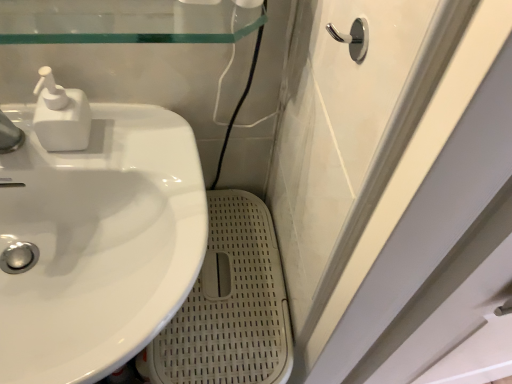
What is the approximate width of polished chrome hook at upper right?

The width of polished chrome hook at upper right is 3.68 centimeters.

Find the location of `polished chrome hook at upper right`. polished chrome hook at upper right is located at coordinates (353, 38).

The width and height of the screenshot is (512, 384). In order to click on white matte soap dispenser at upper left in this screenshot , I will do `click(60, 115)`.

Identify the location of polished chrome hook at upper right. (353, 38).

Do you think white matte soap dispenser at upper left is within white glossy sink at left, or outside of it?

white matte soap dispenser at upper left is outside white glossy sink at left.

From a real-world perspective, which object stands above the other?

From a 3D spatial view, white matte soap dispenser at upper left is above.

Does white matte soap dispenser at upper left appear on the right side of white glossy sink at left?

In fact, white matte soap dispenser at upper left is to the left of white glossy sink at left.

Is white matte soap dispenser at upper left in contact with white glossy sink at left?

No, white matte soap dispenser at upper left is not touching white glossy sink at left.

Can you tell me how much polished chrome hook at upper right and white matte soap dispenser at upper left differ in facing direction?

The facing directions of polished chrome hook at upper right and white matte soap dispenser at upper left are 89.3 degrees apart.

Is polished chrome hook at upper right beside white matte soap dispenser at upper left?

No.

Identify the location of door handle in front of the white matte soap dispenser at upper left. (353, 38).

Could you tell me if polished chrome hook at upper right is turned towards white matte soap dispenser at upper left?

No.

Is point (188, 149) behind point (348, 41)?

Yes, point (188, 149) is farther from viewer.

How different are the orientations of white glossy sink at left and polished chrome hook at upper right in degrees?

The angle between the facing direction of white glossy sink at left and the facing direction of polished chrome hook at upper right is 89.3 degrees.

How far apart are white glossy sink at left and polished chrome hook at upper right?

white glossy sink at left and polished chrome hook at upper right are 18.20 inches apart.

Does white glossy sink at left have a larger size compared to polished chrome hook at upper right?

Yes.

Is white matte soap dispenser at upper left completely or partially outside of polished chrome hook at upper right?

Yes.

From the image's perspective, which one is positioned lower, white matte soap dispenser at upper left or polished chrome hook at upper right?

white matte soap dispenser at upper left appears lower in the image.

Which of these two, white matte soap dispenser at upper left or polished chrome hook at upper right, stands shorter?

With less height is polished chrome hook at upper right.

Which is behind, white matte soap dispenser at upper left or polished chrome hook at upper right?

Positioned behind is white matte soap dispenser at upper left.

Considering the relative sizes of polished chrome hook at upper right and white glossy sink at left in the image provided, is polished chrome hook at upper right thinner than white glossy sink at left?

Yes, polished chrome hook at upper right is thinner than white glossy sink at left.

Would you say polished chrome hook at upper right is to the left or to the right of white glossy sink at left in the picture?

polished chrome hook at upper right is positioned on white glossy sink at left's right side.

Considering the relative positions of polished chrome hook at upper right and white glossy sink at left in the image provided, is polished chrome hook at upper right behind white glossy sink at left?

No, it is in front of white glossy sink at left.

From a real-world perspective, relative to white glossy sink at left, is polished chrome hook at upper right vertically above or below?

Clearly, from a real-world perspective, polished chrome hook at upper right is above white glossy sink at left.

Considering the sizes of objects white glossy sink at left and white matte soap dispenser at upper left in the image provided, who is taller, white glossy sink at left or white matte soap dispenser at upper left?

white glossy sink at left.

How far apart are white glossy sink at left and white matte soap dispenser at upper left?

A distance of 6.10 inches exists between white glossy sink at left and white matte soap dispenser at upper left.

From the picture: In terms of size, does white glossy sink at left appear bigger or smaller than white matte soap dispenser at upper left?

Clearly, white glossy sink at left is larger in size than white matte soap dispenser at upper left.

Which is more to the right, white glossy sink at left or white matte soap dispenser at upper left?

Positioned to the right is white glossy sink at left.

Where is `sink that is below the white matte soap dispenser at upper left (from the image's perspective)`? sink that is below the white matte soap dispenser at upper left (from the image's perspective) is located at coordinates (94, 233).

What are the coordinates of `soap dispenser below the polished chrome hook at upper right (from a real-world perspective)` in the screenshot? It's located at (60, 115).

Looking at the image, which one is located closer to white glossy sink at left, white matte soap dispenser at upper left or polished chrome hook at upper right?

white matte soap dispenser at upper left.

Estimate the real-world distances between objects in this image. Which object is further from white glossy sink at left, polished chrome hook at upper right or white matte soap dispenser at upper left?

polished chrome hook at upper right is positioned further to the anchor white glossy sink at left.

Based on their spatial positions, is white glossy sink at left or polished chrome hook at upper right closer to white matte soap dispenser at upper left?

white glossy sink at left is closer to white matte soap dispenser at upper left.

Looking at the image, which one is located further to white matte soap dispenser at upper left, polished chrome hook at upper right or white glossy sink at left?

polished chrome hook at upper right.

Based on their spatial positions, is white glossy sink at left or white matte soap dispenser at upper left further from polished chrome hook at upper right?

The object further to polished chrome hook at upper right is white glossy sink at left.

Estimate the real-world distances between objects in this image. Which object is closer to polished chrome hook at upper right, white matte soap dispenser at upper left or white glossy sink at left?

white matte soap dispenser at upper left.

Find the location of `sink between white matte soap dispenser at upper left and polished chrome hook at upper right`. sink between white matte soap dispenser at upper left and polished chrome hook at upper right is located at coordinates (94, 233).